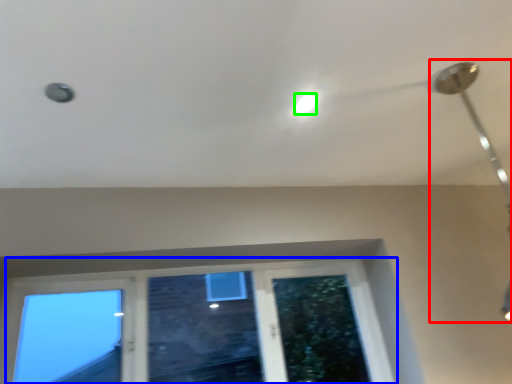
Question: Based on their relative distances, which object is nearer to lamp (highlighted by a red box)? Choose from window (highlighted by a blue box) and droplight (highlighted by a green box).

Choices:
 (A) window
 (B) droplight

Answer: (B)